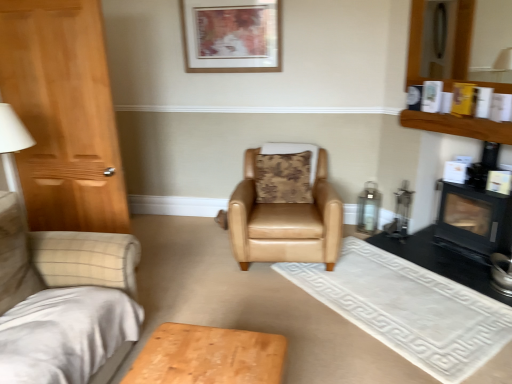
You are a GUI agent. You are given a task and a screenshot of the screen. Output one action in this format:
    pyautogui.click(x=<x>, y=<y>)
    Task: Click on the vacant space positioned to the left of tan leather armchair at center
    The width and height of the screenshot is (512, 384).
    Given the screenshot: What is the action you would take?
    pyautogui.click(x=192, y=259)